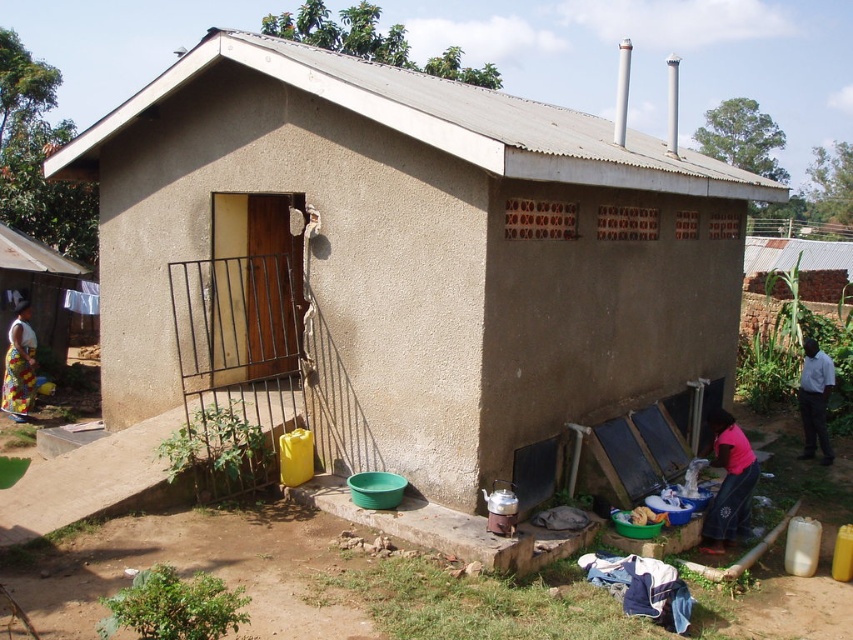
Who is more distant from viewer, (624, 596) or (830, 362)?

The point (830, 362) is more distant.

Is faded denim jacket at lower right positioned before white shirt at right?

Yes.

Is point (659, 586) positioned behind point (805, 388)?

No, it is in front of (805, 388).

Locate an element on the screen. This screenshot has width=853, height=640. faded denim jacket at lower right is located at coordinates (642, 588).

Which is more to the left, brown stucco hut at center or white shirt at right?

brown stucco hut at center is more to the left.

Does brown stucco hut at center have a greater height compared to white shirt at right?

Incorrect, brown stucco hut at center's height is not larger of white shirt at right's.

Between point (602, 156) and point (822, 412), which one is positioned behind?

The point (822, 412) is more distant.

Where is `brown stucco hut at center`? brown stucco hut at center is located at coordinates (408, 253).

Which is below, brown stucco hut at center or pink fabric at lower right?

pink fabric at lower right

Can you confirm if brown stucco hut at center is positioned to the left of pink fabric at lower right?

Indeed, brown stucco hut at center is positioned on the left side of pink fabric at lower right.

Where is `brown stucco hut at center`? brown stucco hut at center is located at coordinates (408, 253).